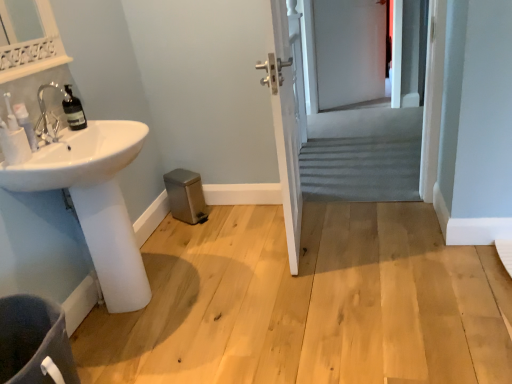
Question: Is white glossy sink at lower left far away from translucent glass bottle at left?

Choices:
 (A) yes
 (B) no

Answer: (B)

Question: Is white glossy sink at lower left at the right side of translucent glass bottle at left?

Choices:
 (A) yes
 (B) no

Answer: (A)

Question: Could you tell me if white glossy sink at lower left is facing translucent glass bottle at left?

Choices:
 (A) yes
 (B) no

Answer: (B)

Question: Is white glossy sink at lower left bigger than translucent glass bottle at left?

Choices:
 (A) yes
 (B) no

Answer: (A)

Question: From the image's perspective, is white glossy sink at lower left located above translucent glass bottle at left?

Choices:
 (A) no
 (B) yes

Answer: (A)

Question: Considering the positions of point [20, 374] and point [67, 87], is point [20, 374] closer or farther from the camera than point [67, 87]?

Choices:
 (A) closer
 (B) farther

Answer: (A)

Question: Considering the positions of dark gray fabric toilet bowl at lower left and translucent glass bottle at left in the image, is dark gray fabric toilet bowl at lower left wider or thinner than translucent glass bottle at left?

Choices:
 (A) thin
 (B) wide

Answer: (B)

Question: Would you say dark gray fabric toilet bowl at lower left is to the left or to the right of translucent glass bottle at left in the picture?

Choices:
 (A) left
 (B) right

Answer: (B)

Question: From the image's perspective, is dark gray fabric toilet bowl at lower left positioned above or below translucent glass bottle at left?

Choices:
 (A) below
 (B) above

Answer: (A)

Question: Is white glossy sink at lower left situated inside translucent glass bottle at left or outside?

Choices:
 (A) outside
 (B) inside

Answer: (A)

Question: Is point (96, 208) closer or farther from the camera than point (71, 91)?

Choices:
 (A) farther
 (B) closer

Answer: (B)

Question: Is white glossy sink at lower left in front of or behind translucent glass bottle at left in the image?

Choices:
 (A) front
 (B) behind

Answer: (A)

Question: Is white glossy sink at lower left to the left or to the right of translucent glass bottle at left in the image?

Choices:
 (A) right
 (B) left

Answer: (A)

Question: Looking at the image, does matte white soap dispenser at left seem bigger or smaller compared to white glossy sink at lower left?

Choices:
 (A) small
 (B) big

Answer: (A)

Question: Considering the positions of matte white soap dispenser at left and white glossy sink at lower left in the image, is matte white soap dispenser at left wider or thinner than white glossy sink at lower left?

Choices:
 (A) wide
 (B) thin

Answer: (B)